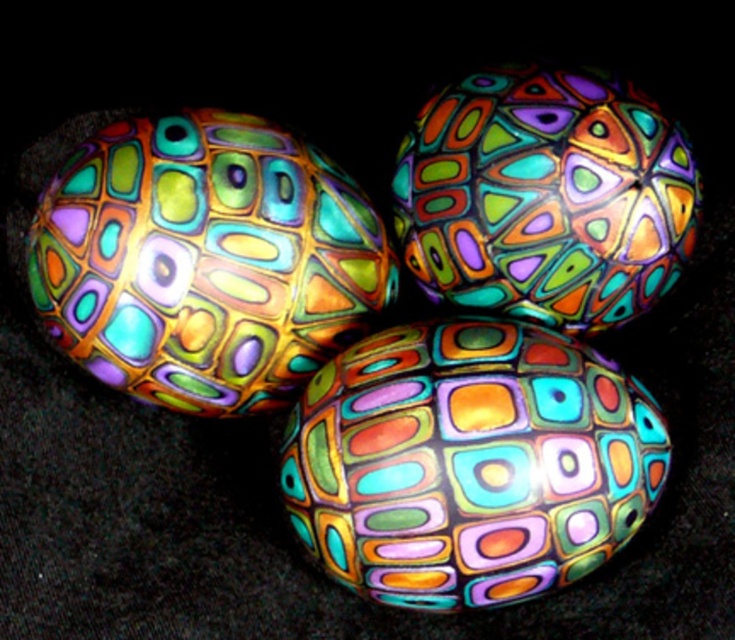
You are an art curator organizing an exhibition. You have a glossy ceramic easter egg at upper center that needs to be placed on a pedestal. The pedestal has a circular base with a diameter of 15 cm. The egg has a diameter of 10 cm. Can the egg be safely placed on the pedestal without touching the edge?

The glossy ceramic easter egg at upper center has a diameter of 10 cm, and the pedestal has a diameter of 15 cm. Since the egg is smaller than the pedestal, there will be a 2.5 cm gap on all sides, so yes, it can be safely placed without touching the edge.